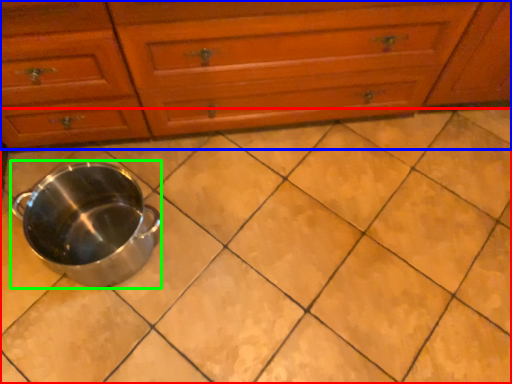
Question: Which object is positioned closest to ceramic tile (highlighted by a red box)? Select from chest of drawers (highlighted by a blue box) and crock pot (highlighted by a green box).

Choices:
 (A) chest of drawers
 (B) crock pot

Answer: (B)